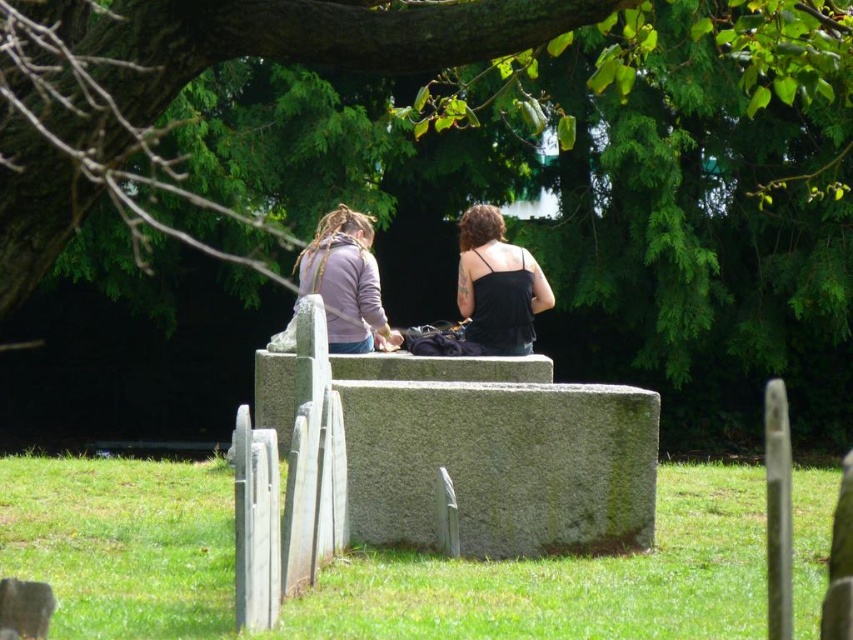
Question: Is green mossy stone at center smaller than green leafy tree at upper center?

Choices:
 (A) no
 (B) yes

Answer: (B)

Question: Which point is closer to the camera?

Choices:
 (A) (485, 225)
 (B) (53, 556)
 (C) (341, 260)

Answer: (B)

Question: Can you confirm if green leafy tree at upper center is thinner than matte purple hoodie at center?

Choices:
 (A) yes
 (B) no

Answer: (B)

Question: Which of the following is the farthest from the observer?

Choices:
 (A) (347, 289)
 (B) (474, 586)
 (C) (482, 320)
 (D) (16, 102)

Answer: (C)

Question: Is green mossy stone at center below black satin tank top at center?

Choices:
 (A) no
 (B) yes

Answer: (B)

Question: Which of the following is the farthest from the observer?

Choices:
 (A) (606, 83)
 (B) (355, 337)

Answer: (B)